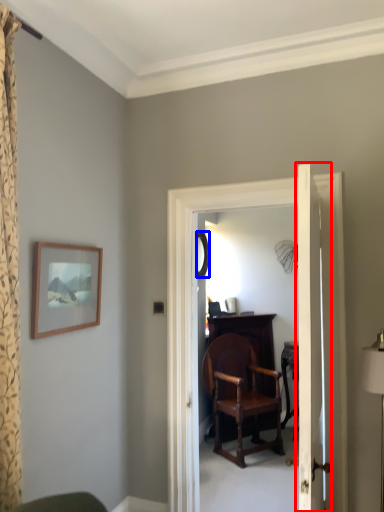
Question: Which point is further to the camera, door (highlighted by a red box) or mirror (highlighted by a blue box)?

Choices:
 (A) door
 (B) mirror

Answer: (B)